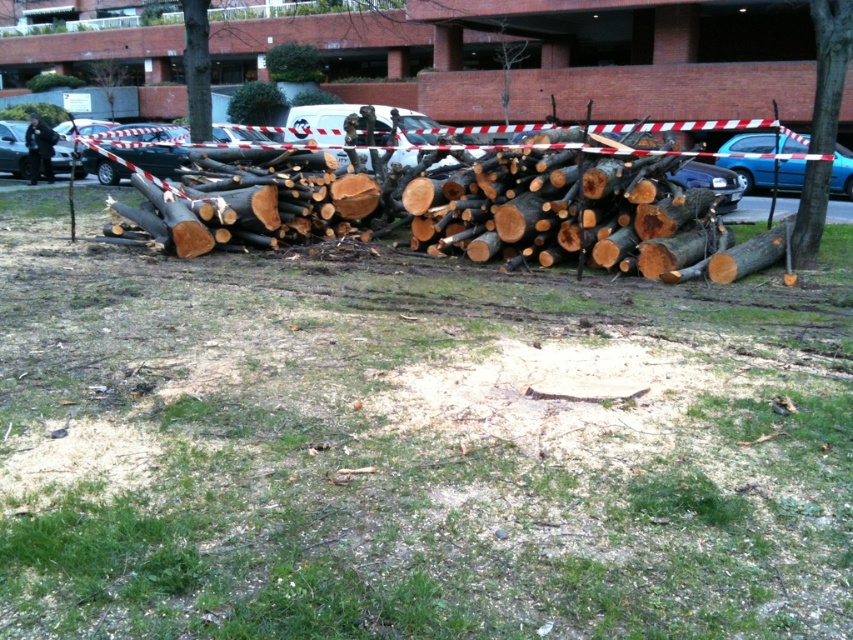
Is the position of green grass at center more distant than that of bare wood tree at center?

Result: No, it is in front of bare wood tree at center.

Is green grass at center closer to the viewer compared to bare wood tree at center?

Yes, green grass at center is closer to the viewer.

Measure the distance between point (473, 266) and camera.

Point (473, 266) and camera are 31.62 feet apart.

This screenshot has height=640, width=853. What are the coordinates of `green grass at center` in the screenshot? It's located at (412, 445).

Does green grass at center appear on the right side of white plastic car at center?

Correct, you'll find green grass at center to the right of white plastic car at center.

Is the position of green grass at center less distant than that of white plastic car at center?

Yes, green grass at center is closer to the viewer.

Does point (384, 355) come farther from viewer compared to point (410, 115)?

No, it is in front of (410, 115).

I want to click on green grass at center, so click(x=412, y=445).

Is white plastic car at center wider than bare wood tree at center?

Yes, white plastic car at center is wider than bare wood tree at center.

This screenshot has height=640, width=853. What are the coordinates of `white plastic car at center` in the screenshot? It's located at (405, 132).